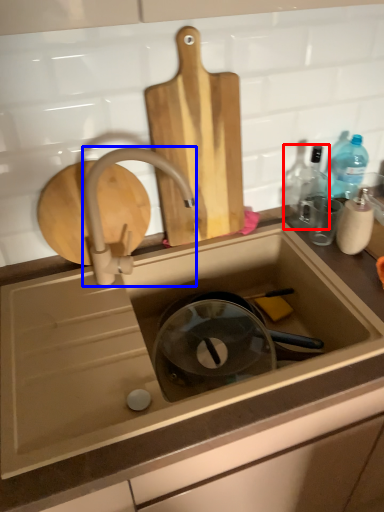
Question: Which object appears closest to the camera in this image, bottle (highlighted by a red box) or tap (highlighted by a blue box)?

Choices:
 (A) bottle
 (B) tap

Answer: (B)